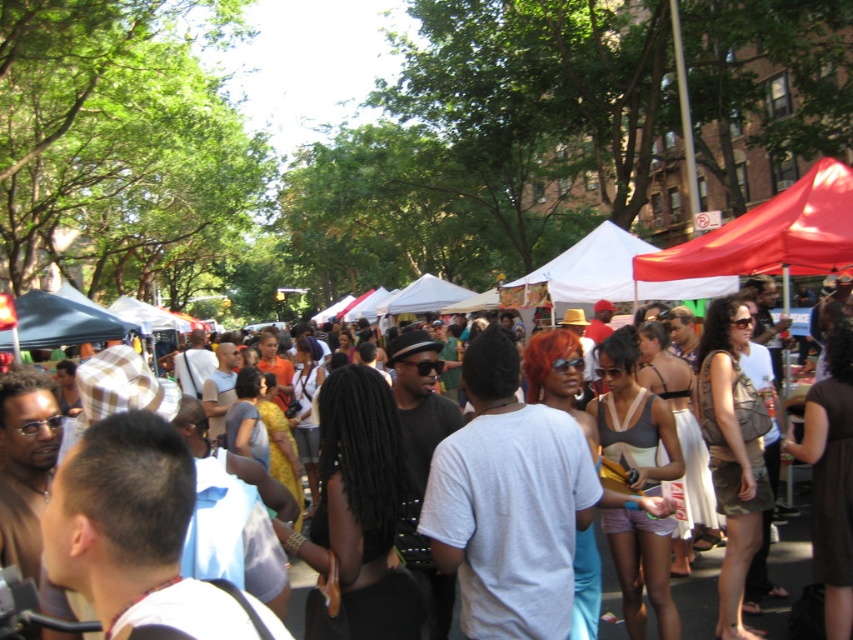
Between point (718, 250) and point (805, 532), which one is positioned behind?

Point (718, 250)

This screenshot has height=640, width=853. Find the location of `red fabric canopy at upper right`. red fabric canopy at upper right is located at coordinates (770, 234).